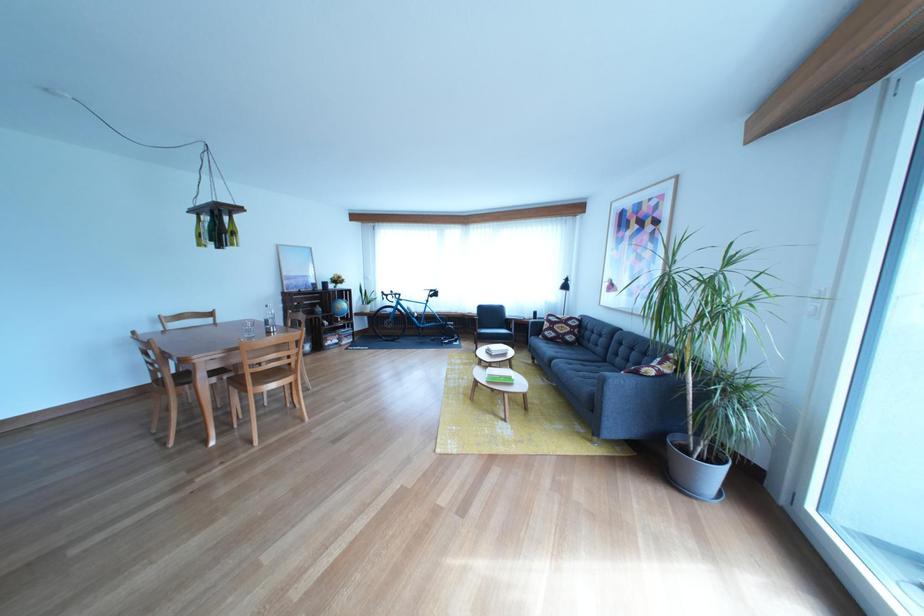
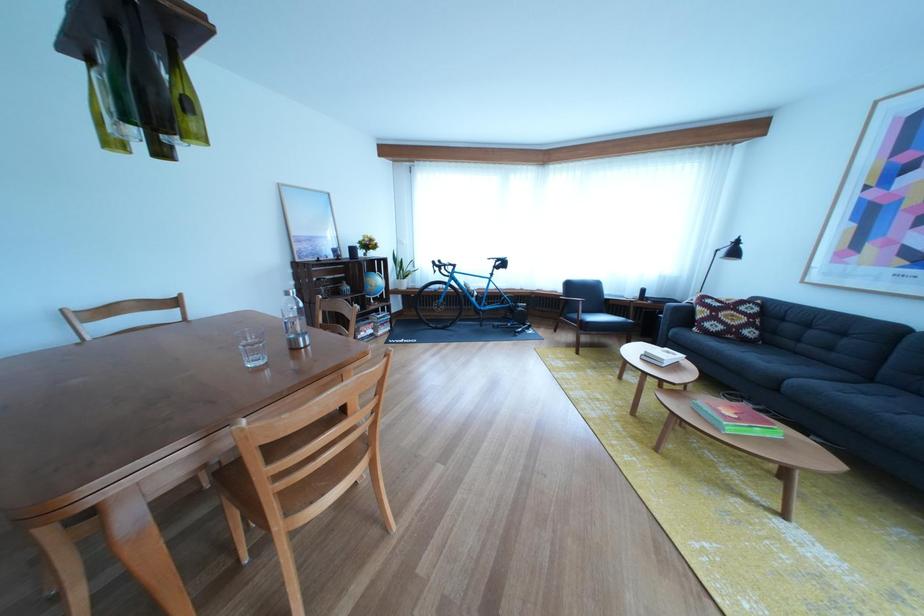
The point at (580, 350) is marked in the first image. Where is the corresponding point in the second image?

(758, 347)